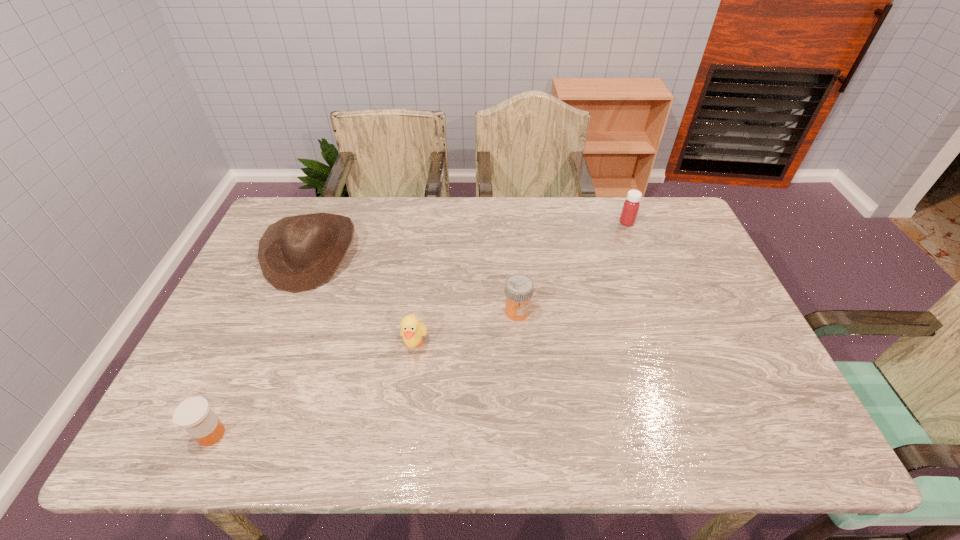
Where is `free spot located 0.090m on the right of the rightmost medicine`? The image size is (960, 540). free spot located 0.090m on the right of the rightmost medicine is located at coordinates (661, 222).

Locate an element on the screen. free spot located on the label side of the second medicine from left to right is located at coordinates (521, 367).

Image resolution: width=960 pixels, height=540 pixels. I want to click on vacant space located 0.160m on the front-facing side of the third object from left to right, so click(x=404, y=420).

I want to click on free space located on the label of the leftmost medicine, so click(x=378, y=434).

Identify the location of cowboy hat that is at the far edge. (297, 253).

This screenshot has width=960, height=540. I want to click on medicine located in the far edge section of the desktop, so click(x=631, y=206).

Find the location of a particular element. This screenshot has height=540, width=960. object that is at the near edge is located at coordinates (194, 414).

Where is `cowboy hat that is at the left edge`? This screenshot has width=960, height=540. cowboy hat that is at the left edge is located at coordinates (297, 253).

This screenshot has height=540, width=960. I want to click on medicine that is at the left edge, so pyautogui.click(x=194, y=414).

Find the location of a particular element. The height and width of the screenshot is (540, 960). object present at the far left corner is located at coordinates (297, 253).